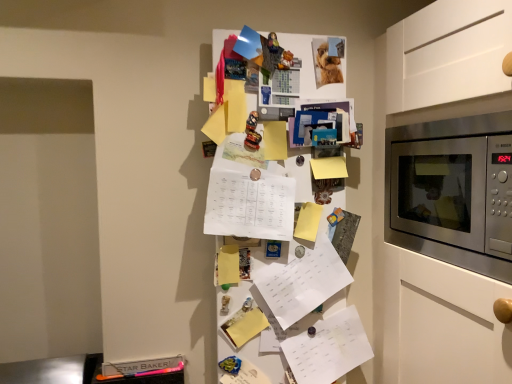
Question: In the image, is white paper at center, acting as the 3th list starting from the top, positioned in front of or behind white paper at center, arranged as the 2th list when ordered from the bottom?

Choices:
 (A) behind
 (B) front

Answer: (A)

Question: Would you say white paper at center, acting as the 3th list starting from the top, is inside or outside white paper at center, the 2th list positioned from the top?

Choices:
 (A) inside
 (B) outside

Answer: (B)

Question: Which of these objects is positioned farthest from the white paper at center, acting as the 1th list starting from the top?

Choices:
 (A) white paper at center, the 2th list positioned from the top
 (B) white paper at center, which is counted as the first list, starting from the bottom
 (C) stainless steel microwave at right

Answer: (C)

Question: Considering the real-world distances, which object is closest to the white paper at center, which is counted as the first list, starting from the bottom?

Choices:
 (A) stainless steel microwave at right
 (B) white paper at center, acting as the 1th list starting from the top
 (C) white paper at center, the 2th list positioned from the top

Answer: (C)